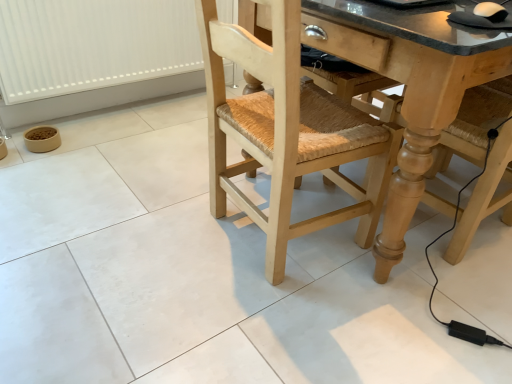
I want to click on vacant space situated on the left part of natural wood chair at center, so click(153, 246).